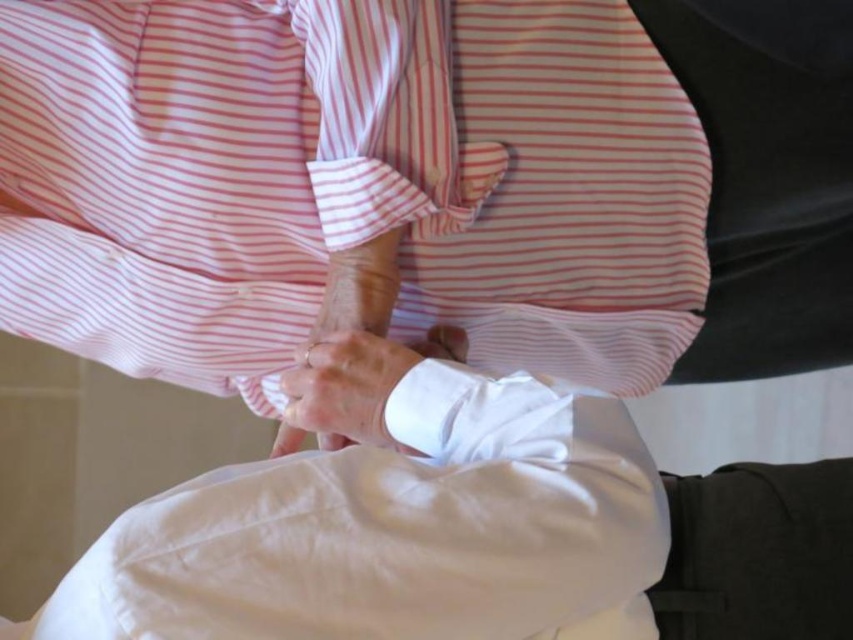
Question: Is pink striped shirt at center to the left of white satin hand at center from the viewer's perspective?

Choices:
 (A) no
 (B) yes

Answer: (B)

Question: Considering the relative positions of pink striped shirt at center and white satin hand at center in the image provided, where is pink striped shirt at center located with respect to white satin hand at center?

Choices:
 (A) above
 (B) below

Answer: (A)

Question: Does pink striped shirt at center come behind white satin hand at center?

Choices:
 (A) no
 (B) yes

Answer: (B)

Question: Among these points, which one is nearest to the camera?

Choices:
 (A) (428, 100)
 (B) (287, 403)

Answer: (A)

Question: Which object is closer to the camera taking this photo?

Choices:
 (A) white satin hand at center
 (B) pink striped shirt at center

Answer: (A)